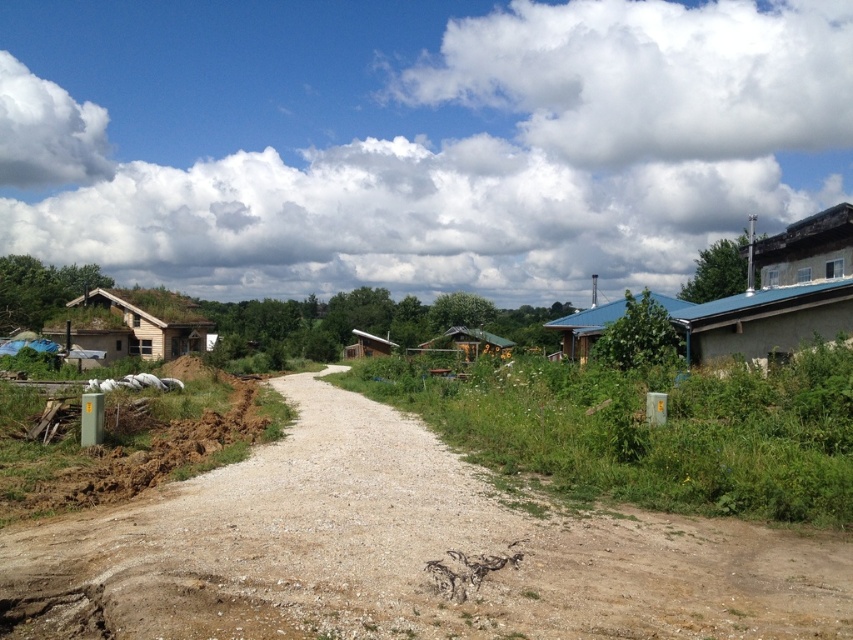
Question: Which object appears farthest from the camera in this image?

Choices:
 (A) brown wooden hut at left
 (B) green wooden hut at center

Answer: (A)

Question: Which point is closer to the camera?

Choices:
 (A) rustic wooden hut at upper right
 (B) wooden hut at center

Answer: (A)

Question: Which object is the closest to the gray concrete hut at right?

Choices:
 (A) rustic wooden hut at upper right
 (B) blue corrugated metal hut at center-right

Answer: (B)

Question: Observing the image, what is the correct spatial positioning of brown gravel road at center in reference to wooden hut at center?

Choices:
 (A) right
 (B) left

Answer: (A)

Question: Can you confirm if brown gravel road at center is bigger than gray concrete hut at right?

Choices:
 (A) yes
 (B) no

Answer: (B)

Question: Is gray concrete hut at right wider than brown wooden hut at left?

Choices:
 (A) yes
 (B) no

Answer: (B)